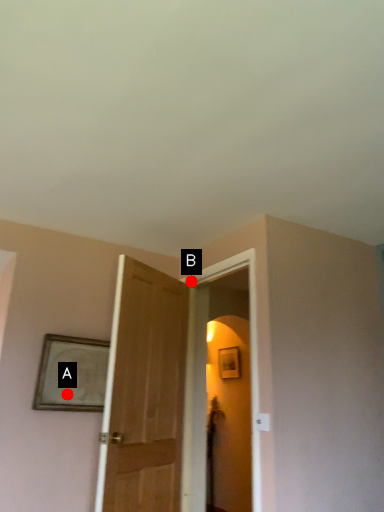
Question: Two points are circled on the image, labeled by A and B beside each circle. Which point is closer to the camera?

Choices:
 (A) A is closer
 (B) B is closer

Answer: (A)